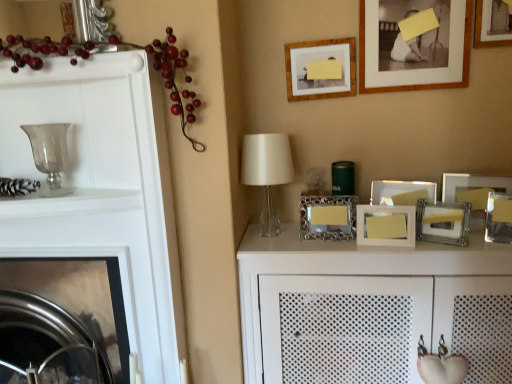
This screenshot has height=384, width=512. I want to click on vacant region to the left of metallic silver photo frame at center, which is the seventh picture frame from top to bottom, so click(289, 239).